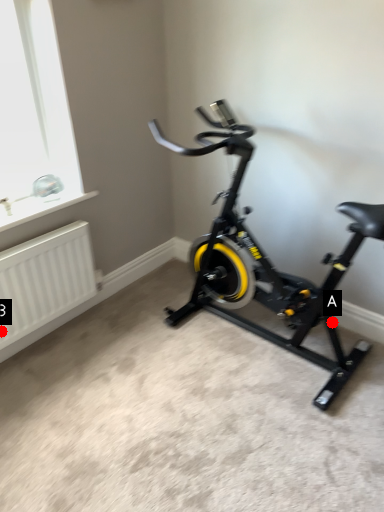
Question: Two points are circled on the image, labeled by A and B beside each circle. Which of the following is the closest to the observer?

Choices:
 (A) A is closer
 (B) B is closer

Answer: (B)